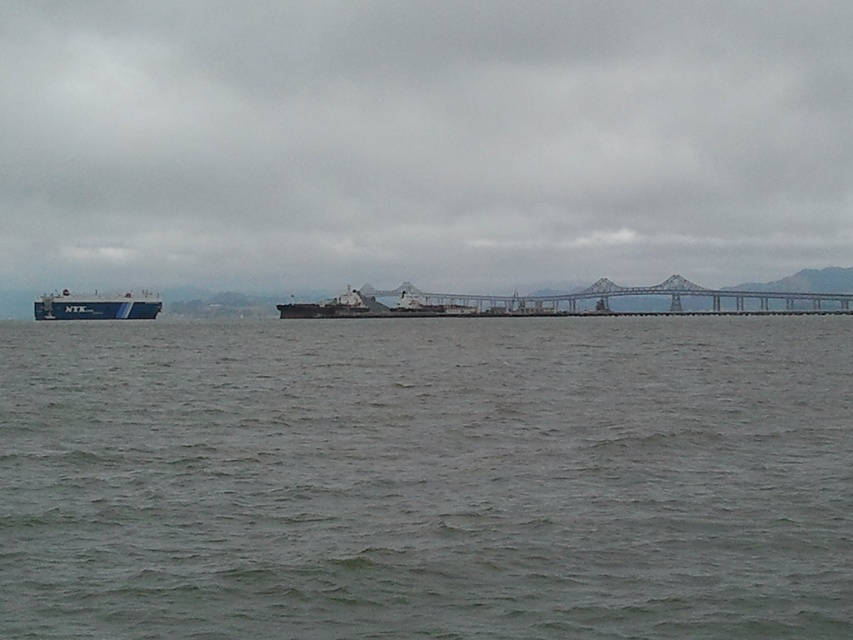
You are a boat captain navigating a narrow channel. You see a point at coordinates (422,141) on your radar. Based on the scene description, what object is located at that point?

The point at coordinates (422,141) is on the blue matte ship at left.

You are a sailor on the blue matte cargo ship at left and want to navigate towards the metallic gray bridge at center. Based on the scene, which direction should you steer your ship to reach the bridge?

The metallic gray bridge at center is positioned on the right side of the blue matte cargo ship at left, so you should steer your ship to the right to reach the bridge.